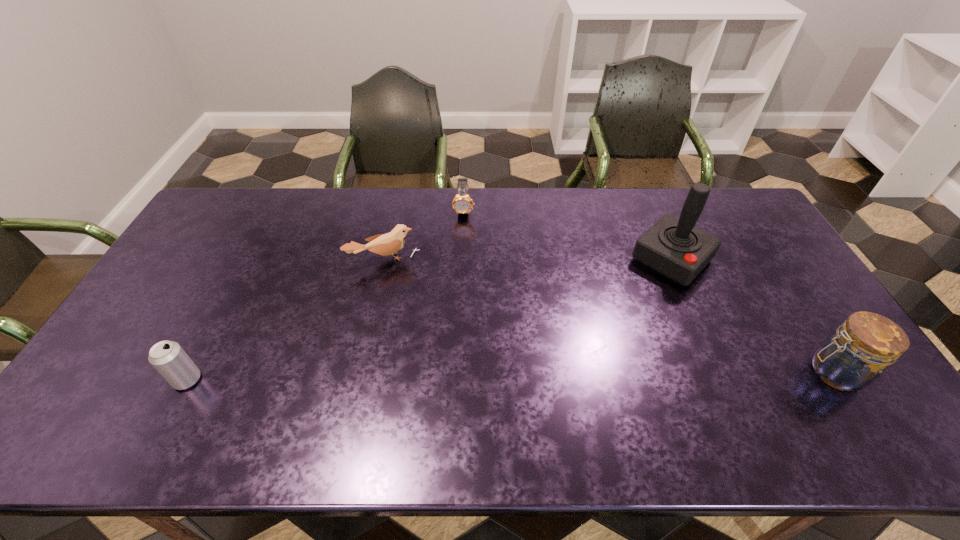
I want to click on vacant space on the desktop that is between the leftmost object and the rightmost object and is positioned at the beak of the second object from left to right, so click(424, 377).

Find the location of `free spot on the desktop that is between the beer can and the rightmost object and is positioned on the base of the tallest object`. free spot on the desktop that is between the beer can and the rightmost object and is positioned on the base of the tallest object is located at coordinates (557, 375).

The width and height of the screenshot is (960, 540). Identify the location of vacant space on the desktop that is between the beer can and the rightmost object and is positioned on the face of the watch. click(x=462, y=376).